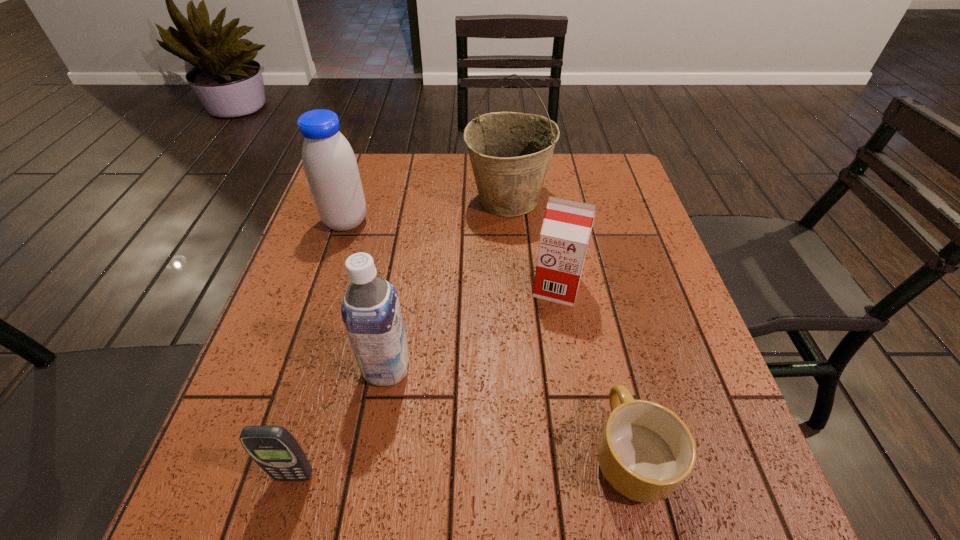
The height and width of the screenshot is (540, 960). In order to click on wine bucket in this screenshot , I will do `click(510, 152)`.

Find the location of a particular element. This screenshot has height=540, width=960. the leftmost soya milk is located at coordinates (330, 166).

Identify the location of the fourth object from right to left. (371, 313).

Locate an element on the screen. The width and height of the screenshot is (960, 540). the nearest soya milk is located at coordinates (371, 313).

What are the coordinates of `the shortest soya milk` in the screenshot? It's located at (567, 224).

What are the coordinates of `the rightmost soya milk` in the screenshot? It's located at (567, 224).

The width and height of the screenshot is (960, 540). I want to click on the second shortest object, so click(273, 448).

Identify the location of mug. (645, 452).

I want to click on vacant position located 0.070m on the left of the wine bucket, so click(441, 200).

Image resolution: width=960 pixels, height=540 pixels. In order to click on vacant space located on the right of the leftmost soya milk in this screenshot , I will do `click(424, 221)`.